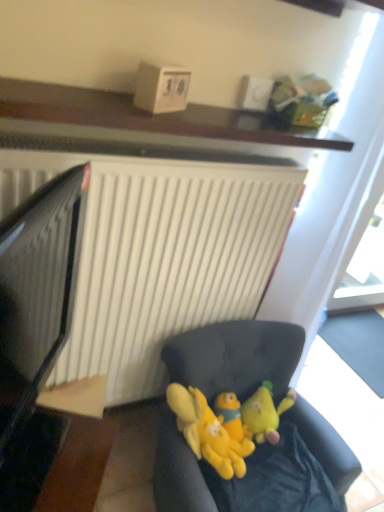
What do you see at coordinates (264, 413) in the screenshot? I see `yellow plush toy at center, the third toy viewed from the left` at bounding box center [264, 413].

Image resolution: width=384 pixels, height=512 pixels. Describe the element at coordinates (153, 116) in the screenshot. I see `wooden shelf at upper center` at that location.

What are the coordinates of `yellow plush toy at center, the second toy viewed from the right` in the screenshot? It's located at (233, 419).

Where is `soft fabric couch at lower center`? soft fabric couch at lower center is located at coordinates (235, 357).

From the image's perspective, is yellow plush toy at center, the second toy viewed from the right, under yellow plush toy at center, which appears as the 1th toy when viewed from the right?

Yes, from the image's perspective, yellow plush toy at center, the second toy viewed from the right, is beneath yellow plush toy at center, which appears as the 1th toy when viewed from the right.

Is yellow plush toy at center, marked as the second toy in a left-to-right arrangement, with yellow plush toy at center, which appears as the 1th toy when viewed from the right?

Yes, yellow plush toy at center, marked as the second toy in a left-to-right arrangement, is in contact with yellow plush toy at center, which appears as the 1th toy when viewed from the right.

Is yellow plush toy at center, marked as the second toy in a left-to-right arrangement, wider or thinner than yellow plush toy at center, the third toy viewed from the left?

Clearly, yellow plush toy at center, marked as the second toy in a left-to-right arrangement, has more width compared to yellow plush toy at center, the third toy viewed from the left.

Is point (257, 394) positioned before point (9, 252)?

No, it is not.

Does yellow plush toy at center, the third toy viewed from the left, have a smaller size compared to black glossy computer monitor at left?

Yes, yellow plush toy at center, the third toy viewed from the left, is smaller than black glossy computer monitor at left.

From the picture: Which of these two, yellow plush toy at center, the third toy viewed from the left, or black glossy computer monitor at left, stands shorter?

With less height is yellow plush toy at center, the third toy viewed from the left.

Is wooden table at lower left facing away from yellow plush toys at center, positioned as the 3th toy in right-to-left order?

wooden table at lower left does not have its back to yellow plush toys at center, positioned as the 3th toy in right-to-left order.

Considering the relative sizes of wooden table at lower left and yellow plush toys at center, positioned as the 3th toy in right-to-left order, in the image provided, is wooden table at lower left taller than yellow plush toys at center, positioned as the 3th toy in right-to-left order,?

Yes, wooden table at lower left is taller than yellow plush toys at center, positioned as the 3th toy in right-to-left order.

Is there a large distance between wooden table at lower left and yellow plush toys at center, placed as the 1th toy when sorted from left to right?

wooden table at lower left is near yellow plush toys at center, placed as the 1th toy when sorted from left to right, not far away.

Could yellow plush toys at center, placed as the 1th toy when sorted from left to right, be considered to be inside soft fabric couch at lower center?

Indeed, yellow plush toys at center, placed as the 1th toy when sorted from left to right, is located within soft fabric couch at lower center.

I want to click on studio couch in front of the yellow plush toys at center, placed as the 1th toy when sorted from left to right, so click(x=235, y=357).

How much distance is there between soft fabric couch at lower center and yellow plush toys at center, positioned as the 3th toy in right-to-left order?

soft fabric couch at lower center and yellow plush toys at center, positioned as the 3th toy in right-to-left order, are 5.09 inches apart.

Does soft fabric couch at lower center have a greater height compared to yellow plush toys at center, positioned as the 3th toy in right-to-left order?

Correct, soft fabric couch at lower center is much taller as yellow plush toys at center, positioned as the 3th toy in right-to-left order.

Where is `the 3rd toy directly beneath the black glossy computer monitor at left (from a real-world perspective)`? Image resolution: width=384 pixels, height=512 pixels. the 3rd toy directly beneath the black glossy computer monitor at left (from a real-world perspective) is located at coordinates (233, 419).

Is the depth of yellow plush toy at center, marked as the second toy in a left-to-right arrangement, greater than that of black glossy computer monitor at left?

Yes.

Which of these two, yellow plush toy at center, marked as the second toy in a left-to-right arrangement, or black glossy computer monitor at left, is thinner?

black glossy computer monitor at left.

From the image's perspective, relative to soft fabric couch at lower center, is transparent glass door at upper right above or below?

Based on their image positions, transparent glass door at upper right is located above soft fabric couch at lower center.

Between transparent glass door at upper right and soft fabric couch at lower center, which one has less height?

soft fabric couch at lower center.

Does point (346, 270) appear closer or farther from the camera than point (206, 501)?

Point (346, 270) appears to be farther away from the viewer than point (206, 501).

Does transparent glass door at upper right come behind soft fabric couch at lower center?

That is True.

Between black glossy computer monitor at left and wooden shelf at upper center, which one appears on the left side from the viewer's perspective?

From the viewer's perspective, black glossy computer monitor at left appears more on the left side.

Considering the positions of points (21, 217) and (60, 116), is point (21, 217) farther from camera compared to point (60, 116)?

No, it is in front of (60, 116).

Does black glossy computer monitor at left have a larger size compared to wooden shelf at upper center?

Yes.

Would you say black glossy computer monitor at left contains wooden shelf at upper center?

Actually, wooden shelf at upper center is outside black glossy computer monitor at left.

Where is `toy that appears on the right of yellow plush toy at center, marked as the second toy in a left-to-right arrangement`? The image size is (384, 512). toy that appears on the right of yellow plush toy at center, marked as the second toy in a left-to-right arrangement is located at coordinates (264, 413).

I want to click on computer monitor located on the left of yellow plush toy at center, the third toy viewed from the left, so click(x=38, y=290).

From the image, which object appears to be nearer to transparent glass door at upper right, yellow plush toys at center, positioned as the 3th toy in right-to-left order, or wooden table at lower left?

yellow plush toys at center, positioned as the 3th toy in right-to-left order, is positioned closer to the anchor transparent glass door at upper right.

From the picture: Which object lies nearer to the anchor point yellow plush toy at center, the third toy viewed from the left, wooden table at lower left or soft fabric couch at lower center?

soft fabric couch at lower center lies closer to yellow plush toy at center, the third toy viewed from the left, than the other object.

Looking at the image, which one is located further to black glossy computer monitor at left, yellow plush toy at center, marked as the second toy in a left-to-right arrangement, or yellow plush toys at center, positioned as the 3th toy in right-to-left order?

yellow plush toy at center, marked as the second toy in a left-to-right arrangement, is positioned further to the anchor black glossy computer monitor at left.

Considering their positions, is yellow plush toy at center, the third toy viewed from the left, positioned closer to wooden table at lower left than transparent glass door at upper right?

Based on the image, yellow plush toy at center, the third toy viewed from the left, appears to be nearer to wooden table at lower left.

From the image, which object appears to be farther from yellow plush toy at center, the second toy viewed from the right, soft fabric couch at lower center or yellow plush toy at center, the third toy viewed from the left?

soft fabric couch at lower center lies further to yellow plush toy at center, the second toy viewed from the right, than the other object.

Looking at the image, which one is located further to yellow plush toy at center, the third toy viewed from the left, wooden shelf at upper center or wooden table at lower left?

wooden shelf at upper center is further to yellow plush toy at center, the third toy viewed from the left.

Considering their positions, is yellow plush toys at center, positioned as the 3th toy in right-to-left order, positioned closer to transparent glass door at upper right than wooden shelf at upper center?

yellow plush toys at center, positioned as the 3th toy in right-to-left order, is positioned closer to the anchor transparent glass door at upper right.

When comparing their distances from yellow plush toy at center, marked as the second toy in a left-to-right arrangement, does yellow plush toy at center, which appears as the 1th toy when viewed from the right, or black glossy computer monitor at left seem closer?

yellow plush toy at center, which appears as the 1th toy when viewed from the right, is closer to yellow plush toy at center, marked as the second toy in a left-to-right arrangement.

The height and width of the screenshot is (512, 384). What are the coordinates of `toy between soft fabric couch at lower center and yellow plush toy at center, the second toy viewed from the right, from front to back` in the screenshot? It's located at (208, 432).

At what (x,y) coordinates should I click in order to perform the action: click on studio couch positioned between wooden shelf at upper center and transparent glass door at upper right from near to far. Please return your answer as a coordinate pair (x, y). Looking at the image, I should click on (235, 357).

This screenshot has width=384, height=512. What are the coordinates of `computer monitor between wooden shelf at upper center and soft fabric couch at lower center vertically` in the screenshot? It's located at (38, 290).

The height and width of the screenshot is (512, 384). I want to click on furniture between black glossy computer monitor at left and transparent glass door at upper right in the front-back direction, so click(153, 116).